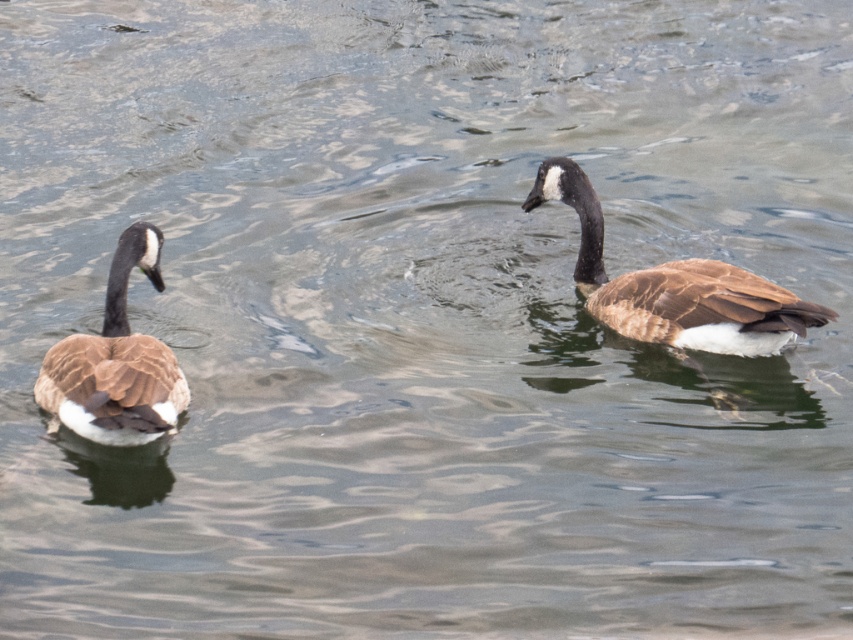
Question: Is brown matte duck at right wider than brown matte duck at left?

Choices:
 (A) no
 (B) yes

Answer: (B)

Question: Which point is closer to the camera?

Choices:
 (A) brown matte duck at right
 (B) brown matte duck at left

Answer: (B)

Question: Is brown matte duck at right to the right of brown matte duck at left from the viewer's perspective?

Choices:
 (A) no
 (B) yes

Answer: (B)

Question: Which point is closer to the camera taking this photo?

Choices:
 (A) 535,195
 (B) 160,388

Answer: (B)

Question: Can you confirm if brown matte duck at right is positioned to the right of brown matte duck at left?

Choices:
 (A) yes
 (B) no

Answer: (A)